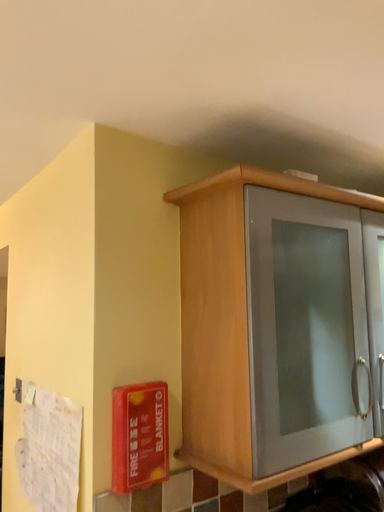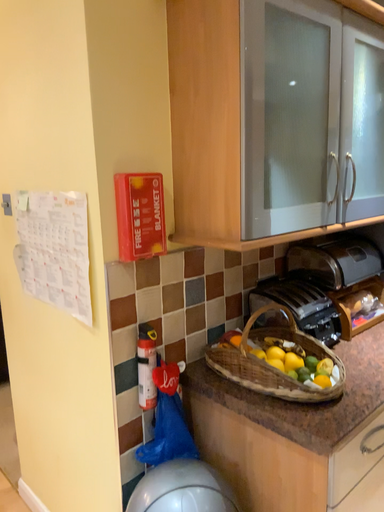
Question: How did the camera likely rotate when shooting the video?

Choices:
 (A) rotated upward
 (B) rotated downward

Answer: (B)